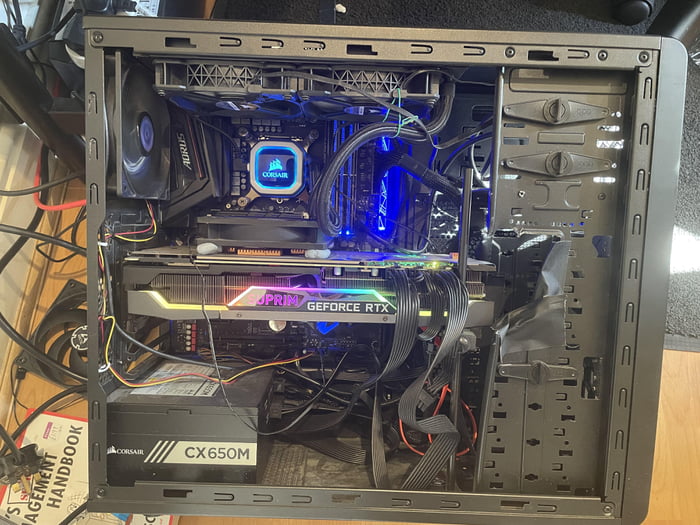
At what (x,y) coordinates should I click in order to perform the action: click on plug. Please return your answer as a coordinate pair (x, y). The height and width of the screenshot is (525, 700). Looking at the image, I should click on (36, 458).